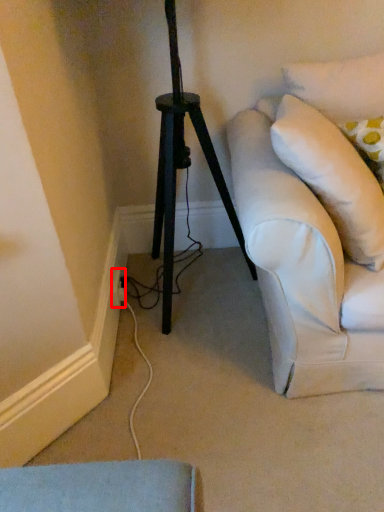
Question: Observing the image, what is the correct spatial positioning of electric outlet (annotated by the red box) in reference to pillow?

Choices:
 (A) left
 (B) right

Answer: (A)